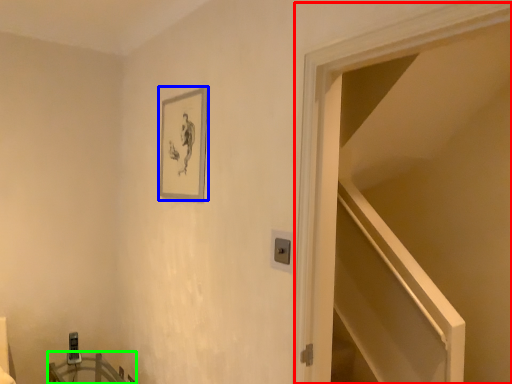
Question: Which object is the closest to the door (highlighted by a red box)? Choose among these: picture frame (highlighted by a blue box) or table (highlighted by a green box).

Choices:
 (A) picture frame
 (B) table

Answer: (A)